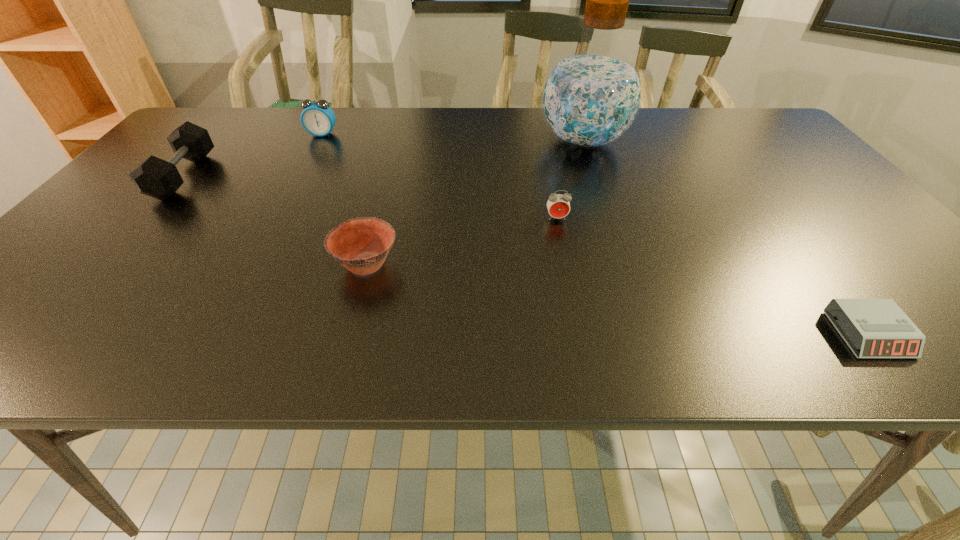
Where is `alarm clock that is the third nearest to the leftmost object`? The image size is (960, 540). alarm clock that is the third nearest to the leftmost object is located at coordinates (878, 328).

Where is `vacant position in the image that satisfies the following two spatial constraints: 1. on the face of the nearest alarm clock; 2. on the left side of the leftmost alarm clock`? Image resolution: width=960 pixels, height=540 pixels. vacant position in the image that satisfies the following two spatial constraints: 1. on the face of the nearest alarm clock; 2. on the left side of the leftmost alarm clock is located at coordinates (217, 334).

Find the location of a particular element. free space that satisfies the following two spatial constraints: 1. on the face of the second tallest alarm clock; 2. on the right side of the nearest object is located at coordinates (580, 334).

Locate an element on the screen. The image size is (960, 540). free point that satisfies the following two spatial constraints: 1. on the face of the farthest alarm clock; 2. on the right side of the tallest object is located at coordinates (319, 141).

Image resolution: width=960 pixels, height=540 pixels. Find the location of `free spot that satisfies the following two spatial constraints: 1. on the face of the second farthest alarm clock; 2. on the right side of the shortest object`. free spot that satisfies the following two spatial constraints: 1. on the face of the second farthest alarm clock; 2. on the right side of the shortest object is located at coordinates (580, 334).